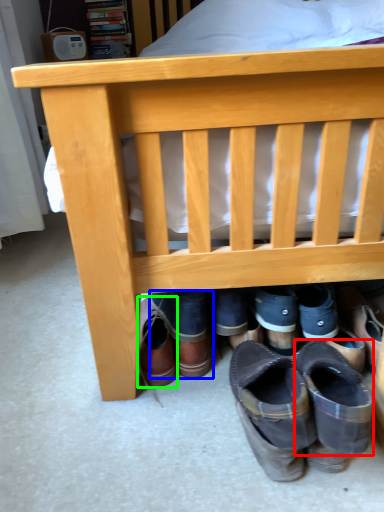
Question: Which object is the farthest from shoe (highlighted by a red box)? Choose among these: footwear (highlighted by a blue box) or footwear (highlighted by a green box).

Choices:
 (A) footwear
 (B) footwear

Answer: (B)